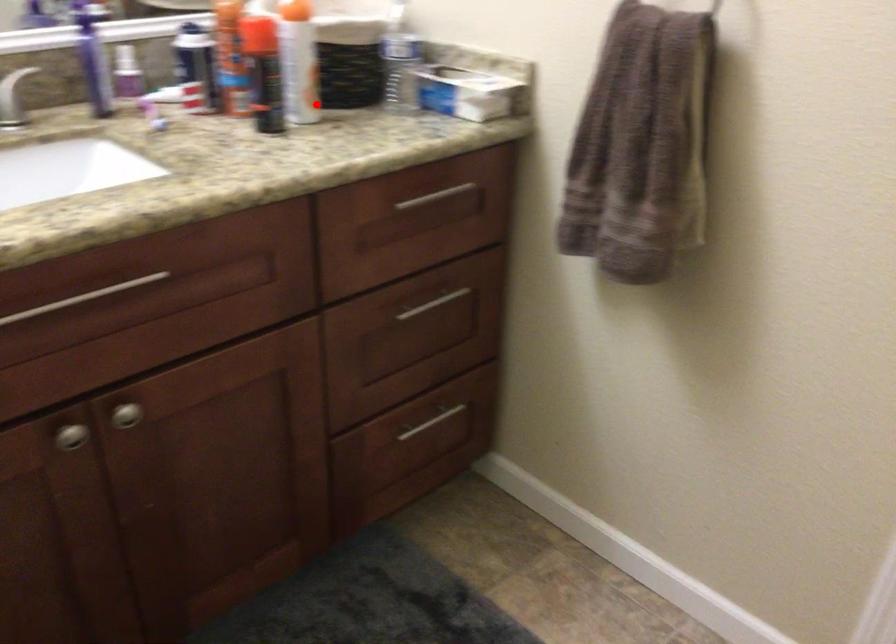
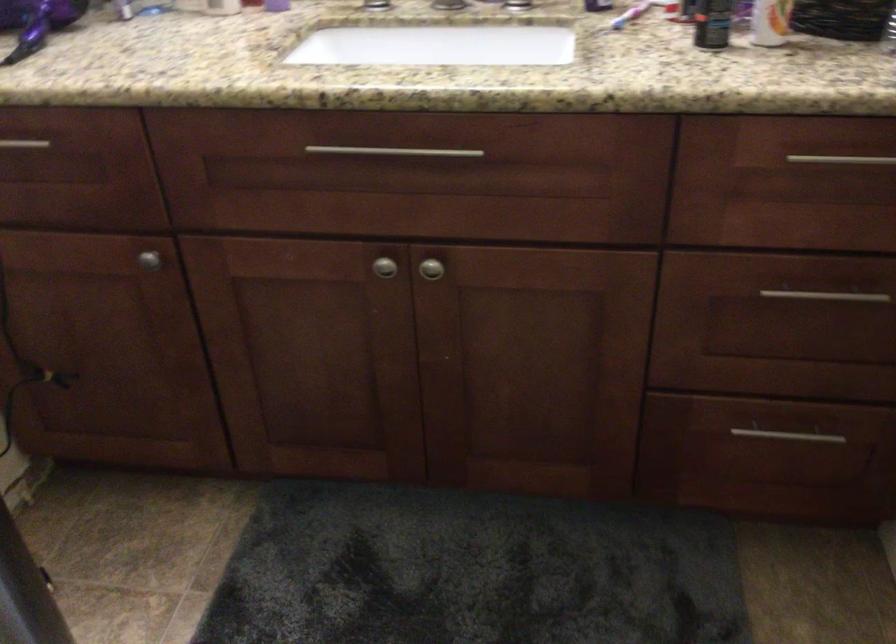
Question: I am providing you with two images of the same scene from different viewpoints. A red point is shown in image1. For the corresponding object point in image2, is it positioned nearer or farther from the camera?

Choices:
 (A) Nearer
 (B) Farther

Answer: (A)